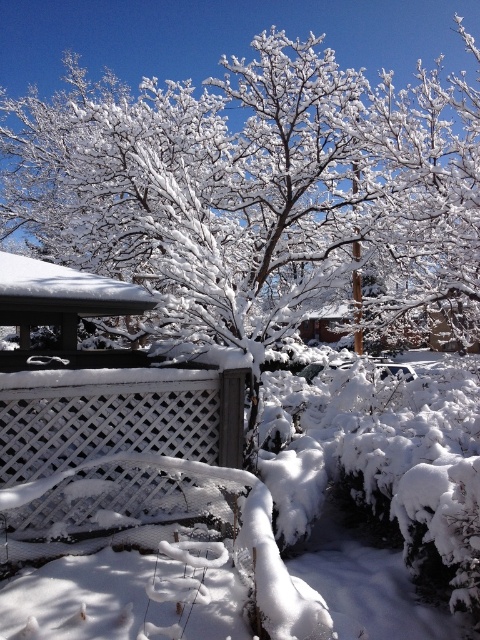
Question: Is white frosty tree at center positioned in front of white lattice fence at center?

Choices:
 (A) yes
 (B) no

Answer: (B)

Question: Which point is closer to the camera taking this photo?

Choices:
 (A) (204, 196)
 (B) (92, 401)

Answer: (B)

Question: Among these objects, which one is farthest from the camera?

Choices:
 (A) white lattice fence at center
 (B) white frosty tree at center

Answer: (B)

Question: Does white frosty tree at center appear on the left side of white lattice fence at center?

Choices:
 (A) no
 (B) yes

Answer: (A)

Question: Is white frosty tree at center behind white lattice fence at center?

Choices:
 (A) yes
 (B) no

Answer: (A)